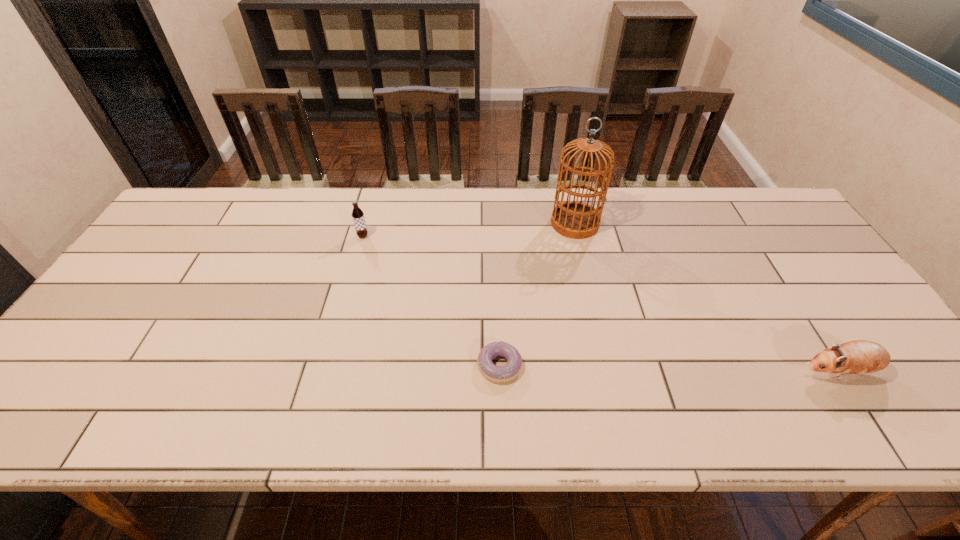
This screenshot has height=540, width=960. Find the location of `the second object from right to left`. the second object from right to left is located at coordinates (576, 220).

This screenshot has width=960, height=540. Identify the location of birdcage. (576, 220).

This screenshot has width=960, height=540. I want to click on root beer, so click(x=357, y=214).

This screenshot has height=540, width=960. Find the location of `the leftmost object`. the leftmost object is located at coordinates (357, 214).

The height and width of the screenshot is (540, 960). In order to click on the rightmost object in this screenshot , I will do `click(856, 357)`.

Find the location of a particular element. the third tallest object is located at coordinates (856, 357).

This screenshot has width=960, height=540. I want to click on the shortest object, so click(499, 374).

This screenshot has height=540, width=960. What are the coordinates of `the second object from left to right` in the screenshot? It's located at (499, 374).

Where is `free space located 0.240m on the front of the tallest object`? This screenshot has width=960, height=540. free space located 0.240m on the front of the tallest object is located at coordinates (592, 299).

Find the location of a particular element. This screenshot has width=960, height=540. free region located on the back of the second tallest object is located at coordinates (370, 214).